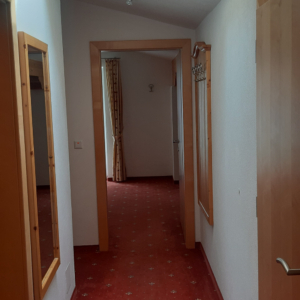
I want to click on mirror, so click(40, 228), click(40, 200), click(37, 141).